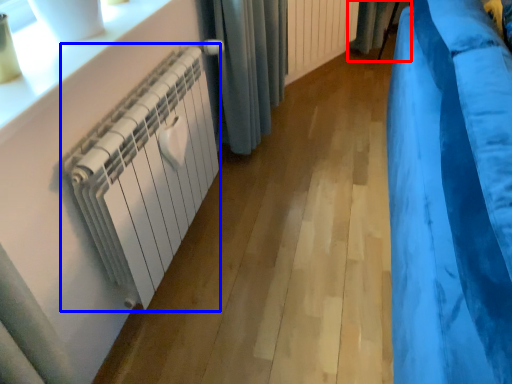
Question: Which object is closer to the camera taking this photo, curtain (highlighted by a red box) or radiator (highlighted by a blue box)?

Choices:
 (A) curtain
 (B) radiator

Answer: (B)